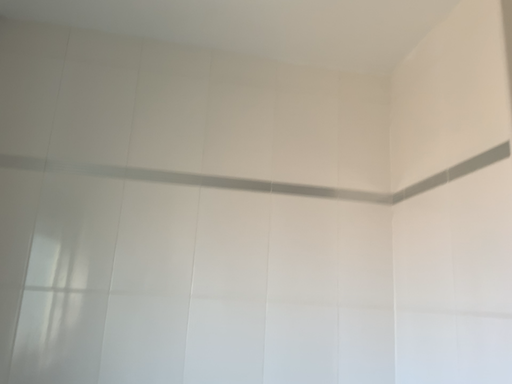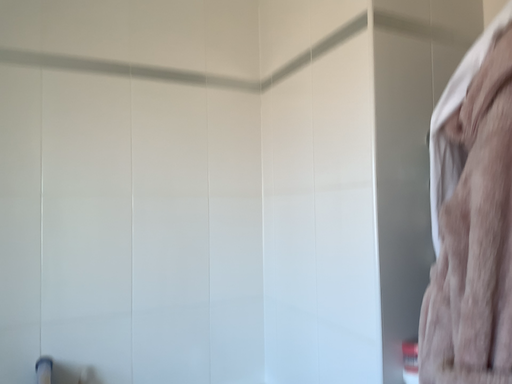
Question: How did the camera likely rotate when shooting the video?

Choices:
 (A) rotated left
 (B) rotated right

Answer: (B)